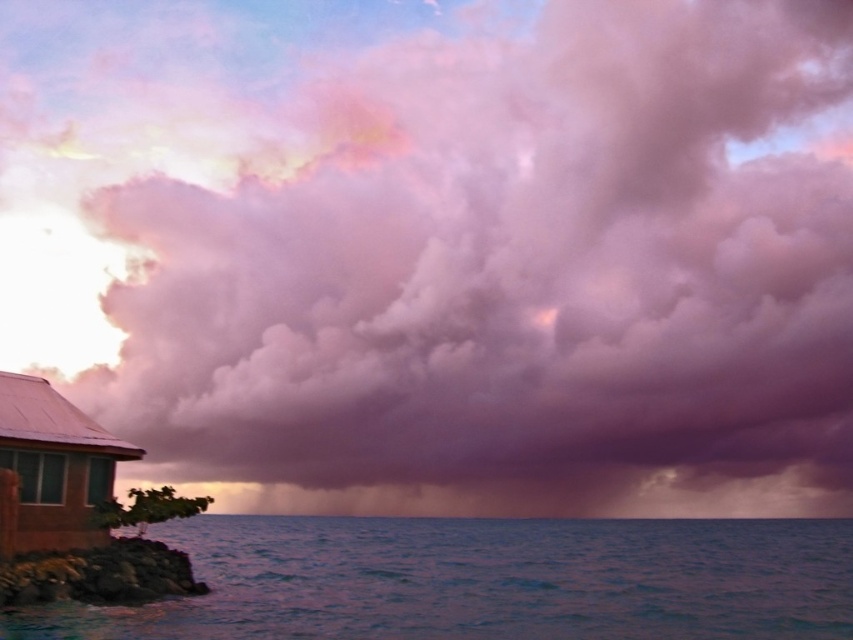
Question: In this image, where is blue water at lower left located relative to brown corrugated metal hut at lower left?

Choices:
 (A) below
 (B) above

Answer: (A)

Question: Among these points, which one is nearest to the camera?

Choices:
 (A) (67, 502)
 (B) (355, 522)

Answer: (A)

Question: Does blue water at lower left appear under brown corrugated metal hut at lower left?

Choices:
 (A) yes
 (B) no

Answer: (A)

Question: Which point appears closest to the camera in this image?

Choices:
 (A) [94, 435]
 (B) [514, 550]

Answer: (A)

Question: Among these points, which one is farthest from the camera?

Choices:
 (A) (264, 528)
 (B) (68, 406)

Answer: (A)

Question: Considering the relative positions of blue water at lower left and brown corrugated metal hut at lower left in the image provided, where is blue water at lower left located with respect to brown corrugated metal hut at lower left?

Choices:
 (A) above
 (B) below

Answer: (B)